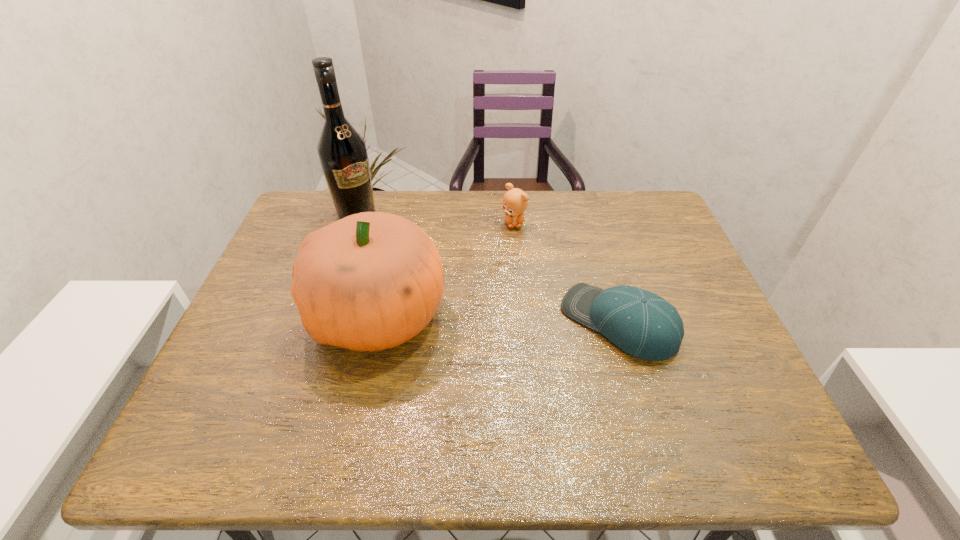
Identify the location of vacant space at the far edge of the desktop. The height and width of the screenshot is (540, 960). (581, 204).

Image resolution: width=960 pixels, height=540 pixels. What are the coordinates of `vacant region at the near edge` in the screenshot? It's located at (636, 387).

The image size is (960, 540). Find the location of `vacant space at the left edge of the desktop`. vacant space at the left edge of the desktop is located at coordinates (271, 282).

This screenshot has width=960, height=540. I want to click on vacant space at the right edge, so click(x=669, y=264).

Image resolution: width=960 pixels, height=540 pixels. I want to click on vacant region at the far left corner, so click(306, 198).

Image resolution: width=960 pixels, height=540 pixels. Identify the location of free space at the near right corner. (752, 378).

Identify the location of free space between the tallest object and the teddy bear. The width and height of the screenshot is (960, 540). (435, 219).

At what (x,y) coordinates should I click in order to perform the action: click on free point between the pumpkin and the third tallest object. Please return your answer as a coordinate pair (x, y). The image size is (960, 540). Looking at the image, I should click on (446, 269).

In order to click on free space that is in between the wine bottle and the rightmost object in this screenshot , I will do `click(487, 268)`.

Identify the location of free spot between the rightmost object and the wine bottle. (487, 268).